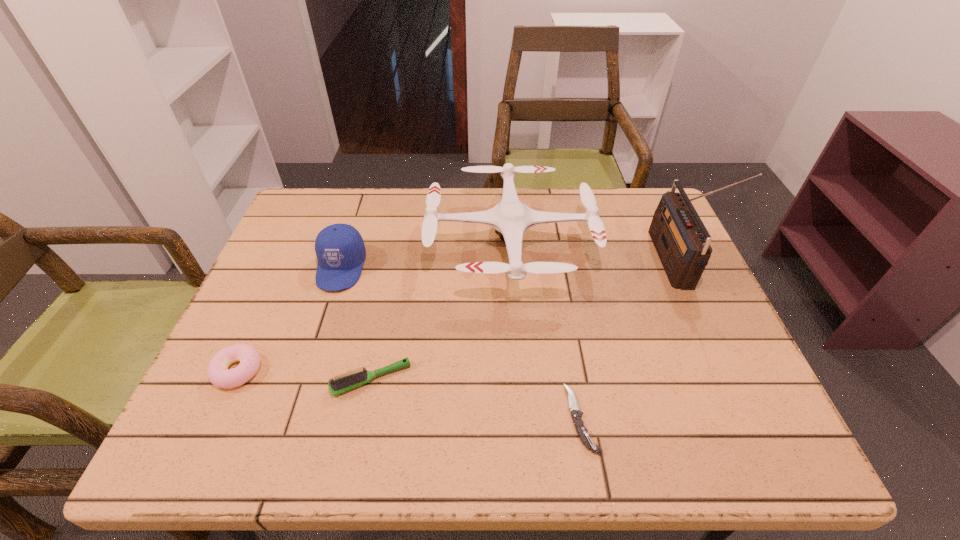
Image resolution: width=960 pixels, height=540 pixels. What are the coordinates of `vacant region located 0.180m with the camera attached at the bottom of the drone` in the screenshot? It's located at (363, 242).

You are a GUI agent. You are given a task and a screenshot of the screen. Output one action in this format:
    pyautogui.click(x=<x>, y=<y>)
    Task: Click on the free space located with the camera attached at the bottom of the drone
    This screenshot has width=960, height=540.
    Given the screenshot: What is the action you would take?
    pyautogui.click(x=292, y=242)

Where is `free space located with the camera attached at the bottom of the drone`? The width and height of the screenshot is (960, 540). free space located with the camera attached at the bottom of the drone is located at coordinates (299, 242).

Identify the location of vacant space located on the front-facing side of the cap. This screenshot has height=540, width=960. (289, 431).

This screenshot has height=540, width=960. Identify the location of vacant space situated 0.090m on the right of the doughnut. (303, 370).

I want to click on vacant area located on the back of the hairbrush, so click(392, 276).

Locate an element on the screen. free space located on the back of the pocketknife is located at coordinates (565, 328).

Locate an element on the screen. The width and height of the screenshot is (960, 540). radio receiver that is at the far edge is located at coordinates (682, 242).

This screenshot has height=540, width=960. Identify the location of drone located in the far edge section of the desktop. (511, 218).

This screenshot has height=540, width=960. In order to click on object at the near edge in this screenshot , I will do `click(582, 432)`.